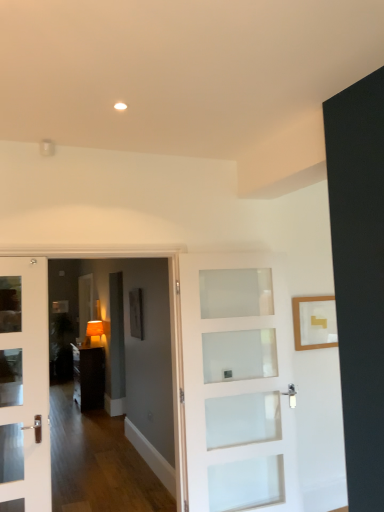
Question: Would you say white frosted glass door at center is outside dark wood cabinet at center?

Choices:
 (A) no
 (B) yes

Answer: (B)

Question: From a real-world perspective, is white frosted glass door at center beneath dark wood cabinet at center?

Choices:
 (A) yes
 (B) no

Answer: (B)

Question: Is the position of white frosted glass door at center less distant than that of dark wood cabinet at center?

Choices:
 (A) no
 (B) yes

Answer: (B)

Question: Considering the relative sizes of white frosted glass door at center and dark wood cabinet at center in the image provided, is white frosted glass door at center wider than dark wood cabinet at center?

Choices:
 (A) no
 (B) yes

Answer: (A)

Question: Are white frosted glass door at center and dark wood cabinet at center located far from each other?

Choices:
 (A) no
 (B) yes

Answer: (B)

Question: Is matte orange lampshade at center inside the boundaries of matte black picture frame at center, arranged as the 2th picture frame when viewed from the front, or outside?

Choices:
 (A) inside
 (B) outside

Answer: (B)

Question: Considering the positions of matte orange lampshade at center and matte black picture frame at center, placed as the second picture frame when sorted from right to left, in the image, is matte orange lampshade at center wider or thinner than matte black picture frame at center, placed as the second picture frame when sorted from right to left,?

Choices:
 (A) wide
 (B) thin

Answer: (A)

Question: Is matte orange lampshade at center taller or shorter than matte black picture frame at center, placed as the second picture frame when sorted from right to left?

Choices:
 (A) short
 (B) tall

Answer: (A)

Question: From a real-world perspective, is matte orange lampshade at center above or below matte black picture frame at center, the 1th picture frame when ordered from back to front?

Choices:
 (A) above
 (B) below

Answer: (B)

Question: Visually, is matte orange lampshade at center positioned to the left or to the right of wooden picture frame at upper right, arranged as the second picture frame when viewed from the left?

Choices:
 (A) right
 (B) left

Answer: (B)

Question: From a real-world perspective, is matte orange lampshade at center positioned above or below wooden picture frame at upper right, the 2th picture frame when ordered from back to front?

Choices:
 (A) below
 (B) above

Answer: (A)

Question: From the image's perspective, is matte orange lampshade at center positioned above or below wooden picture frame at upper right, which is counted as the 1th picture frame, starting from the right?

Choices:
 (A) above
 (B) below

Answer: (B)

Question: In terms of height, does matte orange lampshade at center look taller or shorter compared to wooden picture frame at upper right, arranged as the second picture frame when viewed from the left?

Choices:
 (A) short
 (B) tall

Answer: (A)

Question: Considering the positions of point (84, 355) and point (281, 374), is point (84, 355) closer or farther from the camera than point (281, 374)?

Choices:
 (A) closer
 (B) farther

Answer: (B)

Question: From the image's perspective, is dark wood cabinet at center above or below white frosted glass door at center?

Choices:
 (A) above
 (B) below

Answer: (B)